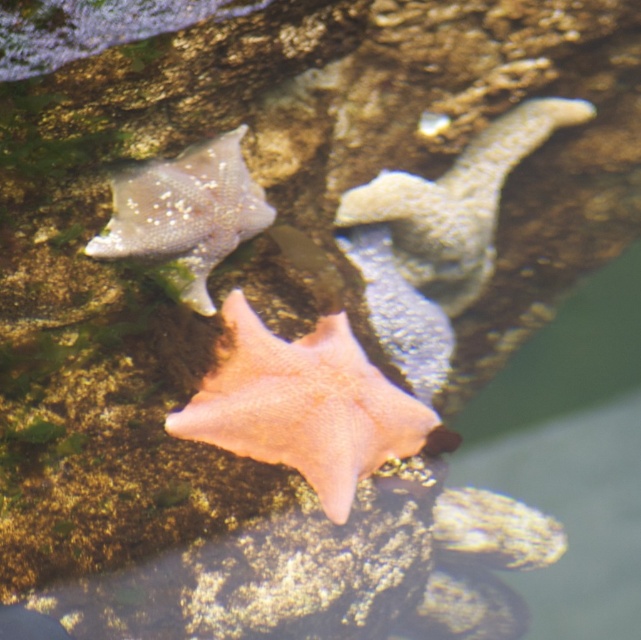
Looking at this image, you are a marine biologist studying starfish in an underwater environment. You need to locate the pink matte starfish at center. According to the coordinates provided, where exactly is it positioned?

The pink matte starfish at center is positioned at coordinates point (304, 404).

You are an underwater photographer trying to capture both the pink matte starfish at center and the smooth gray starfish at center in a single frame. Based on their sizes, which starfish should you focus on to ensure both fit in the frame?

The pink matte starfish at center occupies less space than the smooth gray starfish at center, so you should focus on the larger smooth gray starfish at center to ensure both fit in the frame.

You are an underwater photographer aiming to capture a close shot of the smooth gray starfish at center and the smooth gray starfish at upper left. Which starfish should you focus on if you want to photograph the wider one?

The smooth gray starfish at center might be wider than the smooth gray starfish at upper left, so you should focus on the smooth gray starfish at center to capture the wider one.